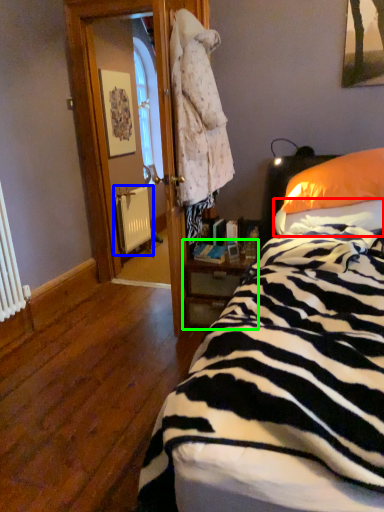
Question: Estimate the real-world distances between objects in this image. Which object is farther from sheet (highlighted by a red box), radiator (highlighted by a blue box) or nightstand (highlighted by a green box)?

Choices:
 (A) radiator
 (B) nightstand

Answer: (A)